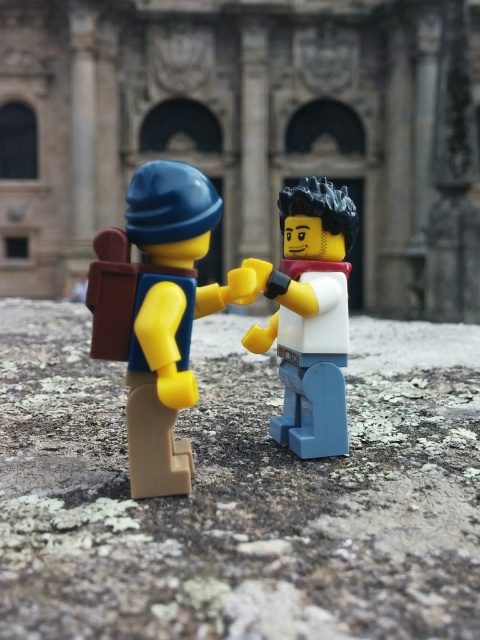
Question: Which point is farther to the camera?

Choices:
 (A) (177, 369)
 (B) (346, 291)

Answer: (B)

Question: Observing the image, what is the correct spatial positioning of matte yellow backpack at left in reference to white matte figure at center?

Choices:
 (A) below
 (B) above

Answer: (B)

Question: Which object is farther from the camera taking this photo?

Choices:
 (A) white matte figure at center
 (B) matte yellow backpack at left

Answer: (A)

Question: Is matte yellow backpack at left bigger than white matte figure at center?

Choices:
 (A) yes
 (B) no

Answer: (A)

Question: Does matte yellow backpack at left appear over white matte figure at center?

Choices:
 (A) yes
 (B) no

Answer: (A)